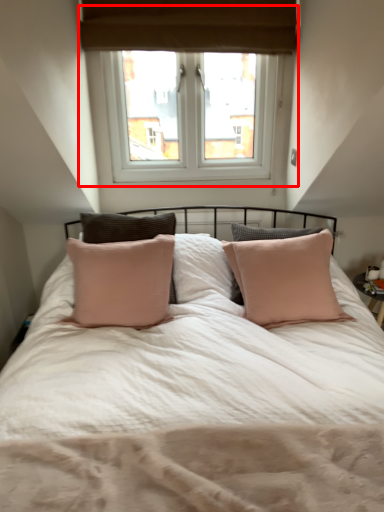
Question: From the image's perspective, where is window (annotated by the red box) located relative to mattress?

Choices:
 (A) above
 (B) below

Answer: (A)